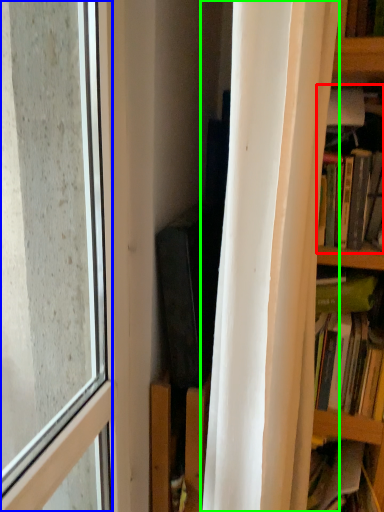
Question: Considering the real-world distances, which object is farthest from book (highlighted by a red box)? window (highlighted by a blue box) or curtain (highlighted by a green box)?

Choices:
 (A) window
 (B) curtain

Answer: (A)